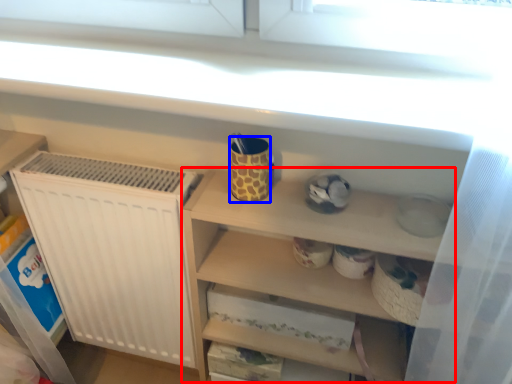
Question: Which object appears closest to the camera in this image, cabinet (highlighted by a red box) or mug (highlighted by a blue box)?

Choices:
 (A) cabinet
 (B) mug

Answer: (A)